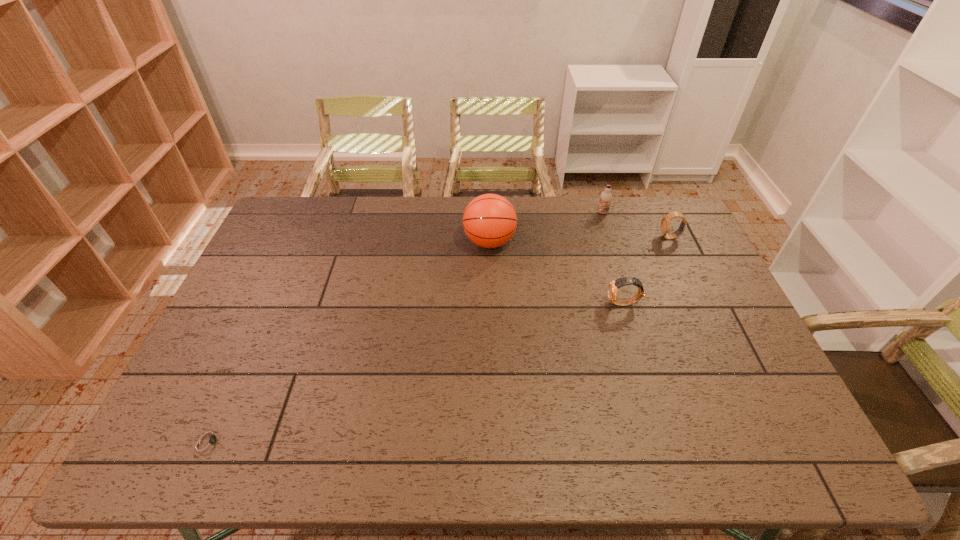
The image size is (960, 540). Find the location of `free space located on the left of the chocolate milk`. free space located on the left of the chocolate milk is located at coordinates (581, 213).

This screenshot has width=960, height=540. I want to click on vacant region located 0.070m on the face of the rightmost watch, so [640, 237].

At what (x,y) coordinates should I click in order to perform the action: click on vacant region located on the face of the rightmost watch. Please return your answer as a coordinate pair (x, y). This screenshot has width=960, height=540. Looking at the image, I should click on (x=645, y=237).

Locate an element on the screen. The width and height of the screenshot is (960, 540). vacant space located on the face of the rightmost watch is located at coordinates (569, 237).

The width and height of the screenshot is (960, 540). In order to click on vacant region located on the face of the second nearest object in this screenshot , I will do `click(488, 303)`.

The height and width of the screenshot is (540, 960). Find the location of `vacant space located on the face of the second nearest object`. vacant space located on the face of the second nearest object is located at coordinates (577, 303).

This screenshot has height=540, width=960. Find the location of `free location located 0.350m on the face of the second nearest object`. free location located 0.350m on the face of the second nearest object is located at coordinates (491, 303).

Locate an element on the screen. free space located on the face of the nearest watch is located at coordinates (295, 441).

The width and height of the screenshot is (960, 540). Identify the location of basketball positioned at the far edge. (489, 220).

Locate an element on the screen. chocolate milk that is at the far edge is located at coordinates (606, 197).